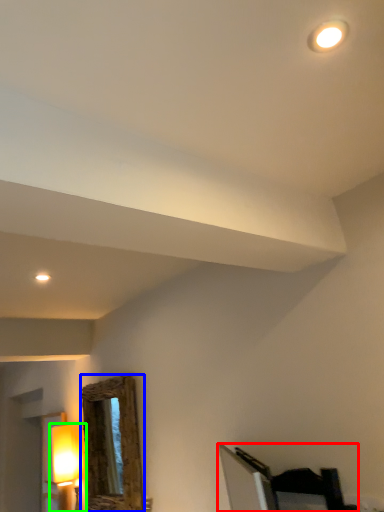
Question: Which object is the closest to the furniture (highlighted by a red box)? Choose among these: mirror (highlighted by a blue box) or lamp (highlighted by a green box).

Choices:
 (A) mirror
 (B) lamp

Answer: (A)